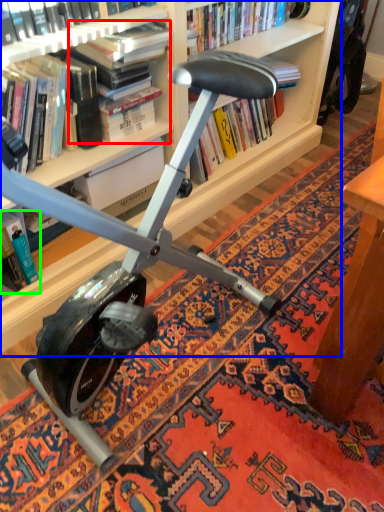
Question: Which object is positioned farthest from book (highlighted by a red box)? Select from bookcase (highlighted by a blue box) and book (highlighted by a green box).

Choices:
 (A) bookcase
 (B) book

Answer: (B)